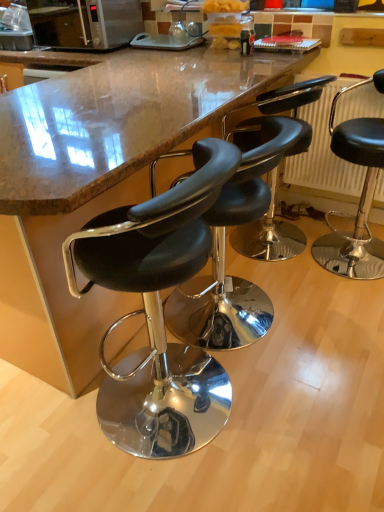
Question: Considering the relative sizes of metallic silver microwave at upper left and black leather stool at center, which is the fourth chair in right-to-left order, in the image provided, is metallic silver microwave at upper left taller than black leather stool at center, which is the fourth chair in right-to-left order,?

Choices:
 (A) no
 (B) yes

Answer: (A)

Question: Does metallic silver microwave at upper left have a larger size compared to black leather stool at center, positioned as the first chair in left-to-right order?

Choices:
 (A) yes
 (B) no

Answer: (B)

Question: Is metallic silver microwave at upper left at the right side of black leather stool at center, which is the fourth chair in right-to-left order?

Choices:
 (A) yes
 (B) no

Answer: (B)

Question: From the image's perspective, is metallic silver microwave at upper left under black leather stool at center, positioned as the first chair in left-to-right order?

Choices:
 (A) no
 (B) yes

Answer: (A)

Question: From a real-world perspective, is metallic silver microwave at upper left on top of black leather stool at center, positioned as the first chair in left-to-right order?

Choices:
 (A) yes
 (B) no

Answer: (A)

Question: Is metallic silver microwave at upper left smaller than black leather stool at center, which is the fourth chair in right-to-left order?

Choices:
 (A) yes
 (B) no

Answer: (A)

Question: Does marble countertop at center have a lesser width compared to metallic radiator at right?

Choices:
 (A) yes
 (B) no

Answer: (B)

Question: From a real-world perspective, is marble countertop at center physically below metallic radiator at right?

Choices:
 (A) no
 (B) yes

Answer: (B)

Question: From the image's perspective, is marble countertop at center located beneath metallic radiator at right?

Choices:
 (A) yes
 (B) no

Answer: (A)

Question: Considering the relative sizes of marble countertop at center and metallic radiator at right in the image provided, is marble countertop at center smaller than metallic radiator at right?

Choices:
 (A) yes
 (B) no

Answer: (B)

Question: Does marble countertop at center come behind metallic radiator at right?

Choices:
 (A) no
 (B) yes

Answer: (A)

Question: Is marble countertop at center located outside metallic radiator at right?

Choices:
 (A) no
 (B) yes

Answer: (B)

Question: From a real-world perspective, is black leather stool at center, which is the 2th chair from right to left, on top of metallic radiator at right?

Choices:
 (A) yes
 (B) no

Answer: (B)